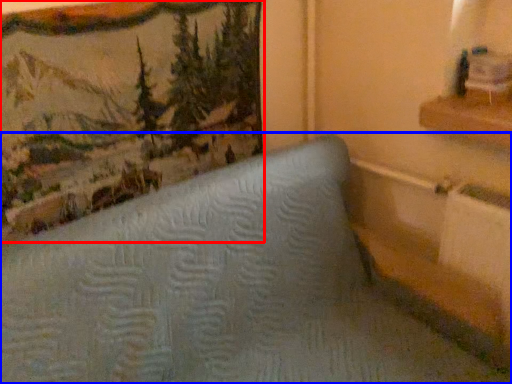
Question: Which of the following is the closest to the observer, picture frame (highlighted by a red box) or furniture (highlighted by a blue box)?

Choices:
 (A) picture frame
 (B) furniture

Answer: (B)